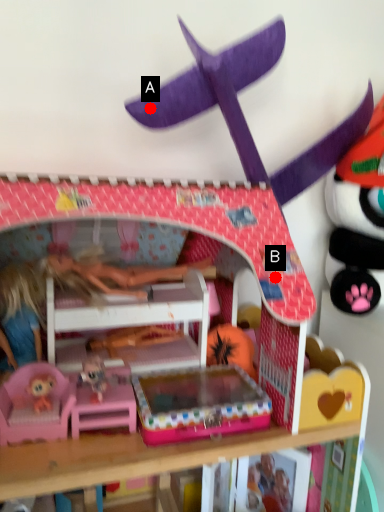
Question: Two points are circled on the image, labeled by A and B beside each circle. Which point appears closest to the camera in this image?

Choices:
 (A) A is closer
 (B) B is closer

Answer: (B)